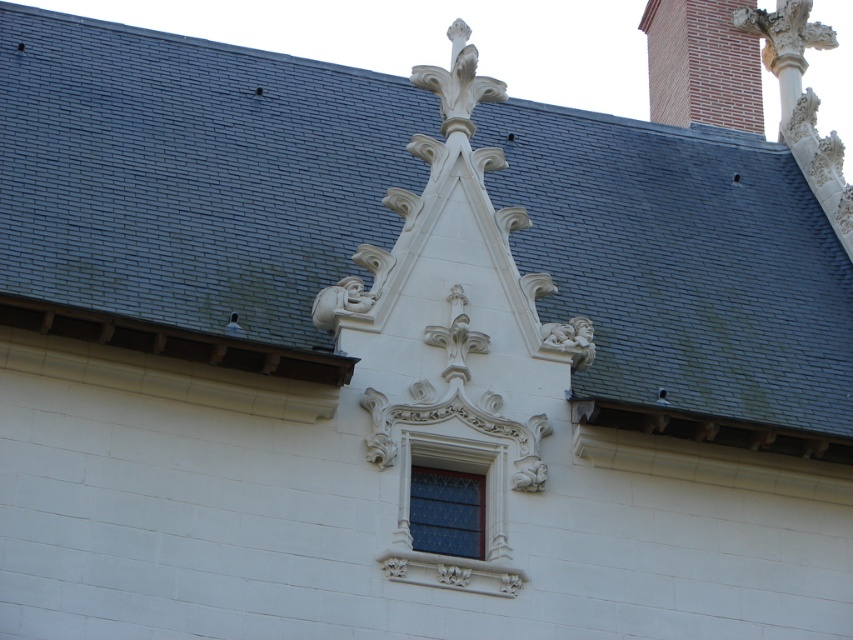
You are an architect analyzing the building facade. You need to compare the widths of the red brick chimney at upper right and the stained glass window at center. Which one is wider?

The red brick chimney at upper right is wider than the stained glass window at center according to the description.

You are a drone operator trying to capture a photo of the red brick chimney at upper right. The drone has a maximum range of 250 feet. Can the drone safely reach the chimney without exceeding its range?

The red brick chimney at upper right is 255.31 feet away from camera. Since the drone has a maximum range of 250 feet, it cannot safely reach the chimney without exceeding its range.

You are an architect examining the building exterior. You need to determine if the red brick chimney at upper right can be seen from the street level below. Considering the stained glass window at center is positioned lower, would the chimney be obstructed by the window?

The red brick chimney at upper right is larger in size than the stained glass window at center. Since the window is positioned lower, the chimney, being larger and higher up, would not be obstructed by the window and would remain visible from street level.